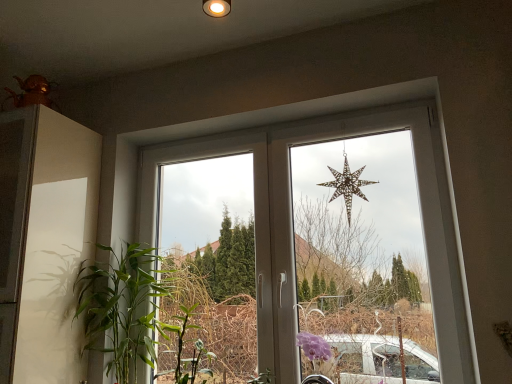
Question: Would you say green leafy plant at left is part of metallic star at center's contents?

Choices:
 (A) no
 (B) yes

Answer: (A)

Question: Is metallic star at center at the left side of green leafy plant at left?

Choices:
 (A) yes
 (B) no

Answer: (B)

Question: Considering the relative sizes of metallic star at center and green leafy plant at left in the image provided, is metallic star at center bigger than green leafy plant at left?

Choices:
 (A) no
 (B) yes

Answer: (B)

Question: Can you confirm if metallic star at center is thinner than green leafy plant at left?

Choices:
 (A) no
 (B) yes

Answer: (B)

Question: Considering the relative sizes of metallic star at center and green leafy plant at left in the image provided, is metallic star at center wider than green leafy plant at left?

Choices:
 (A) no
 (B) yes

Answer: (A)

Question: Is metallic star at center positioned behind green leafy plant at left?

Choices:
 (A) no
 (B) yes

Answer: (A)

Question: Could you tell me if metallic gold star at upper center is turned towards green leafy plant at left?

Choices:
 (A) yes
 (B) no

Answer: (B)

Question: Does metallic gold star at upper center have a greater height compared to green leafy plant at left?

Choices:
 (A) yes
 (B) no

Answer: (B)

Question: From the image's perspective, is metallic gold star at upper center on top of green leafy plant at left?

Choices:
 (A) yes
 (B) no

Answer: (A)

Question: Is metallic gold star at upper center placed right next to green leafy plant at left?

Choices:
 (A) yes
 (B) no

Answer: (B)

Question: Is metallic gold star at upper center positioned beyond the bounds of green leafy plant at left?

Choices:
 (A) no
 (B) yes

Answer: (B)

Question: From a real-world perspective, is metallic gold star at upper center located beneath green leafy plant at left?

Choices:
 (A) no
 (B) yes

Answer: (A)

Question: Does green leafy plant at left have a larger size compared to metallic gold star at upper center?

Choices:
 (A) yes
 (B) no

Answer: (A)